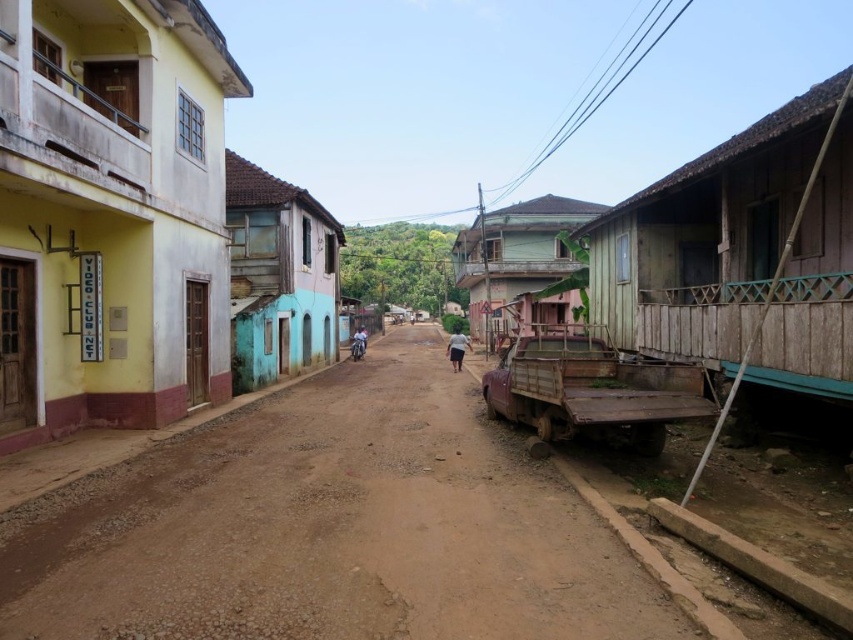
Question: Does wooden hut at right lie behind light blue fabric shirt at center?

Choices:
 (A) no
 (B) yes

Answer: (A)

Question: Does brown dirt track at center appear on the left side of wooden hut at right?

Choices:
 (A) yes
 (B) no

Answer: (A)

Question: Among these objects, which one is farthest from the camera?

Choices:
 (A) brown dirt track at center
 (B) yellow matte building at left
 (C) rustic wooden hut at center

Answer: (C)

Question: Estimate the real-world distances between objects in this image. Which object is farther from the blue painted wood hut at center?

Choices:
 (A) brown dirt track at center
 (B) white matte shirt at center
 (C) rustic wooden hut at center
 (D) yellow matte building at left

Answer: (D)

Question: Which object is positioned closest to the brown dirt track at center?

Choices:
 (A) white matte shirt at center
 (B) yellow matte building at left
 (C) rustic wooden hut at center

Answer: (B)

Question: Is wooden hut at right positioned before blue painted wood hut at center?

Choices:
 (A) no
 (B) yes

Answer: (B)